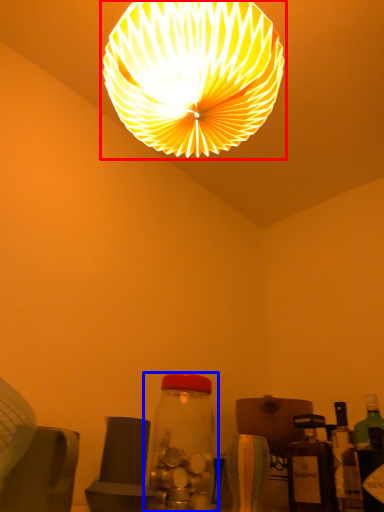
Question: Which object is further to the camera taking this photo, lamp (highlighted by a red box) or bottle (highlighted by a blue box)?

Choices:
 (A) lamp
 (B) bottle

Answer: (B)